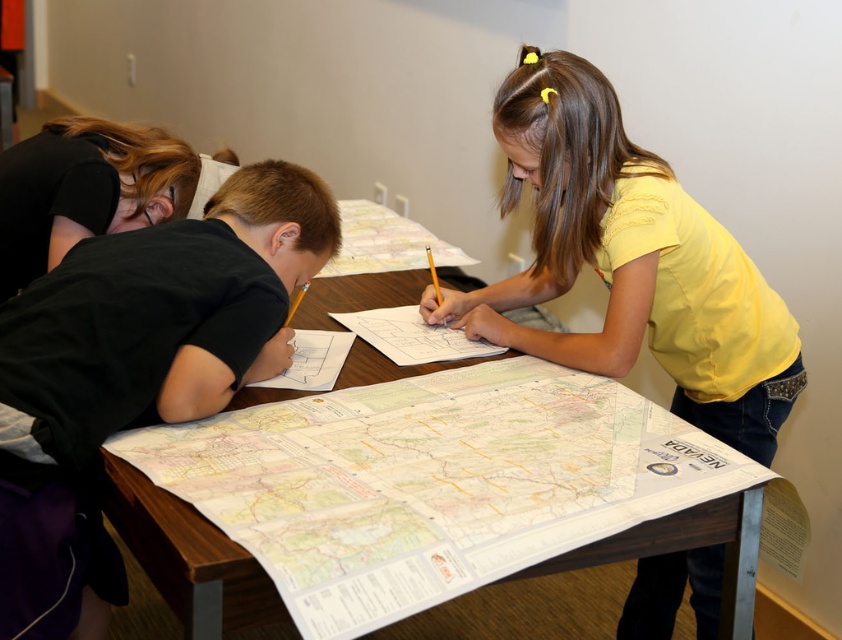
You are a teacher observing the children. You notice the black matte shirt at left and the wooden table at center. Which object is wider?

The black matte shirt at left is wider than the wooden table at center.

You are a teacher observing the classroom scene. You notice the yellow cotton shirt at center and the wooden table at center. Which object takes up more space in the image?

The wooden table at center takes up more space in the image because it is larger than the yellow cotton shirt at center.

You are a teacher observing the scene. You need to hand out a worksheet to the child wearing the black matte shirt at left and the child at the wooden table at center. Which child is closer to you?

The black matte shirt at left is closer to you since they are in front of the wooden table at center.